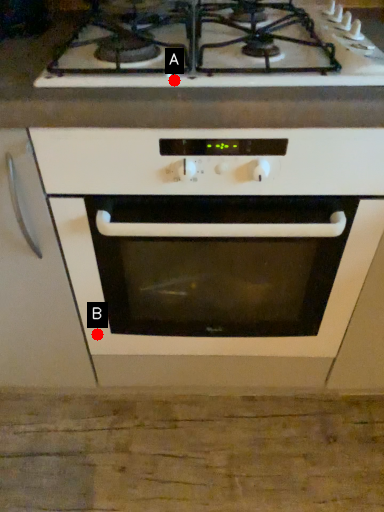
Question: Two points are circled on the image, labeled by A and B beside each circle. Which point is closer to the camera taking this photo?

Choices:
 (A) A is closer
 (B) B is closer

Answer: (A)